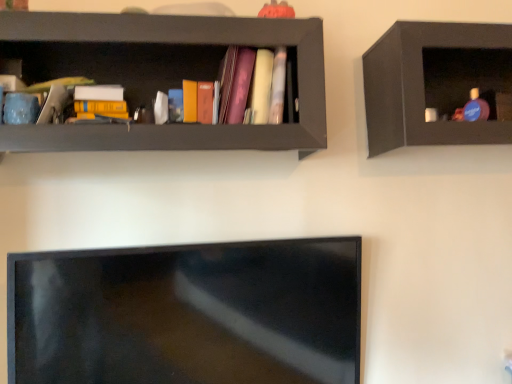
At what (x,y) coordinates should I click in order to perform the action: click on matte black shelf at upper left, positioned as the second shelf in right-to-left order. Please return your answer as a coordinate pair (x, y). This screenshot has height=384, width=512. Looking at the image, I should click on (163, 76).

I want to click on matte pink book at center, so click(x=254, y=86).

Describe the element at coordinates (437, 84) in the screenshot. I see `matte black shelf at upper right, which is the 2th shelf from left to right` at that location.

In order to click on matte black shelf at upper left, positioned as the second shelf in right-to-left order in this screenshot , I will do click(x=163, y=76).

Is matte black shelf at upper right, positioned as the first shelf in right-to-left order, oriented away from matte pink book at center?

No, matte pink book at center is not at the back of matte black shelf at upper right, positioned as the first shelf in right-to-left order.

In terms of height, does matte black shelf at upper right, positioned as the first shelf in right-to-left order, look taller or shorter compared to matte pink book at center?

Considering their sizes, matte black shelf at upper right, positioned as the first shelf in right-to-left order, has more height than matte pink book at center.

Would you say matte black shelf at upper right, positioned as the first shelf in right-to-left order, is to the left or to the right of matte pink book at center in the picture?

From the image, it's evident that matte black shelf at upper right, positioned as the first shelf in right-to-left order, is to the right of matte pink book at center.

Considering the positions of point (426, 127) and point (226, 89), is point (426, 127) closer or farther from the camera than point (226, 89)?

Point (426, 127).

In the image, is matte pink book at center on the left side or the right side of matte black shelf at upper left, the 1th shelf viewed from the left?

In the image, matte pink book at center appears on the right side of matte black shelf at upper left, the 1th shelf viewed from the left.

Is matte pink book at center not close to matte black shelf at upper left, the 1th shelf viewed from the left?

matte pink book at center is actually quite close to matte black shelf at upper left, the 1th shelf viewed from the left.

From a real-world perspective, between matte pink book at center and matte black shelf at upper left, positioned as the second shelf in right-to-left order, who is vertically higher?

From a 3D spatial view, matte pink book at center is above.

Between point (266, 80) and point (263, 130), which one is positioned behind?

Positioned behind is point (266, 80).

Identify the location of the 2nd shelf located beneath the matte pink book at center (from a real-world perspective). The width and height of the screenshot is (512, 384). (437, 84).

From a real-world perspective, is matte pink book at center above or below matte black shelf at upper right, which is the 2th shelf from left to right?

Clearly, from a real-world perspective, matte pink book at center is above matte black shelf at upper right, which is the 2th shelf from left to right.

Which point is more distant from viewer, (230, 57) or (419, 76)?

Positioned behind is point (230, 57).

From the image's perspective, is matte pink book at center located beneath matte black shelf at upper right, positioned as the first shelf in right-to-left order?

Yes.

From a real-world perspective, is matte black shelf at upper right, which is the 2th shelf from left to right, located beneath matte black shelf at upper left, the 1th shelf viewed from the left?

Yes, from a real-world perspective, matte black shelf at upper right, which is the 2th shelf from left to right, is under matte black shelf at upper left, the 1th shelf viewed from the left.

Considering the positions of objects matte black shelf at upper right, which is the 2th shelf from left to right, and matte black shelf at upper left, positioned as the second shelf in right-to-left order, in the image provided, who is behind, matte black shelf at upper right, which is the 2th shelf from left to right, or matte black shelf at upper left, positioned as the second shelf in right-to-left order,?

A: matte black shelf at upper right, which is the 2th shelf from left to right, is behind.

Are matte black shelf at upper right, which is the 2th shelf from left to right, and matte black shelf at upper left, the 1th shelf viewed from the left, making contact?

matte black shelf at upper right, which is the 2th shelf from left to right, and matte black shelf at upper left, the 1th shelf viewed from the left, are not in contact.

Can you confirm if matte black shelf at upper right, positioned as the first shelf in right-to-left order, is wider than matte black shelf at upper left, positioned as the second shelf in right-to-left order?

In fact, matte black shelf at upper right, positioned as the first shelf in right-to-left order, might be narrower than matte black shelf at upper left, positioned as the second shelf in right-to-left order.

From their relative heights in the image, would you say matte black shelf at upper left, the 1th shelf viewed from the left, is taller or shorter than matte pink book at center?

matte black shelf at upper left, the 1th shelf viewed from the left, is taller than matte pink book at center.

How different are the orientations of matte black shelf at upper left, positioned as the second shelf in right-to-left order, and matte pink book at center in degrees?

The angular difference between matte black shelf at upper left, positioned as the second shelf in right-to-left order, and matte pink book at center is 0.366 degrees.

Considering the relative positions of matte black shelf at upper left, the 1th shelf viewed from the left, and matte pink book at center in the image provided, is matte black shelf at upper left, the 1th shelf viewed from the left, to the left of matte pink book at center from the viewer's perspective?

Indeed, matte black shelf at upper left, the 1th shelf viewed from the left, is positioned on the left side of matte pink book at center.

From a real-world perspective, which is physically above, matte black shelf at upper left, positioned as the second shelf in right-to-left order, or matte pink book at center?

In real-world perspective, matte pink book at center is above.

From a real-world perspective, which is physically below, matte black shelf at upper left, positioned as the second shelf in right-to-left order, or matte black shelf at upper right, which is the 2th shelf from left to right?

matte black shelf at upper right, which is the 2th shelf from left to right.

Do you think matte black shelf at upper left, the 1th shelf viewed from the left, is within matte black shelf at upper right, which is the 2th shelf from left to right, or outside of it?

The correct answer is: outside.

At what (x,y) coordinates should I click in order to perform the action: click on shelf above the matte black shelf at upper right, positioned as the first shelf in right-to-left order (from a real-world perspective). Please return your answer as a coordinate pair (x, y). Image resolution: width=512 pixels, height=384 pixels. Looking at the image, I should click on (163, 76).

What are the coordinates of `shelf that appears above the matte pink book at center (from the image's perspective)` in the screenshot? It's located at (437, 84).

Find the location of a particular element. This screenshot has height=384, width=512. shelf that is the 1st object directly below the matte pink book at center (from a real-world perspective) is located at coordinates (163, 76).

Estimate the real-world distances between objects in this image. Which object is closer to matte black shelf at upper right, positioned as the first shelf in right-to-left order, matte black shelf at upper left, the 1th shelf viewed from the left, or matte pink book at center?

Based on the image, matte pink book at center appears to be nearer to matte black shelf at upper right, positioned as the first shelf in right-to-left order.

Estimate the real-world distances between objects in this image. Which object is further from matte black shelf at upper left, the 1th shelf viewed from the left, matte pink book at center or matte black shelf at upper right, positioned as the first shelf in right-to-left order?

Among the two, matte black shelf at upper right, positioned as the first shelf in right-to-left order, is located further to matte black shelf at upper left, the 1th shelf viewed from the left.

From the image, which object appears to be nearer to matte pink book at center, matte black shelf at upper right, positioned as the first shelf in right-to-left order, or matte black shelf at upper left, positioned as the second shelf in right-to-left order?

Based on the image, matte black shelf at upper left, positioned as the second shelf in right-to-left order, appears to be nearer to matte pink book at center.

Estimate the real-world distances between objects in this image. Which object is closer to matte black shelf at upper left, the 1th shelf viewed from the left, matte black shelf at upper right, positioned as the first shelf in right-to-left order, or matte pink book at center?

Based on the image, matte pink book at center appears to be nearer to matte black shelf at upper left, the 1th shelf viewed from the left.

Looking at the image, which one is located further to matte black shelf at upper right, which is the 2th shelf from left to right, matte pink book at center or matte black shelf at upper left, positioned as the second shelf in right-to-left order?

matte black shelf at upper left, positioned as the second shelf in right-to-left order.

From the image, which object appears to be nearer to matte pink book at center, matte black shelf at upper left, the 1th shelf viewed from the left, or matte black shelf at upper right, positioned as the first shelf in right-to-left order?

Among the two, matte black shelf at upper left, the 1th shelf viewed from the left, is located nearer to matte pink book at center.

Find the location of a particular element. book between matte black shelf at upper left, positioned as the second shelf in right-to-left order, and matte black shelf at upper right, positioned as the first shelf in right-to-left order, from left to right is located at coordinates (254, 86).